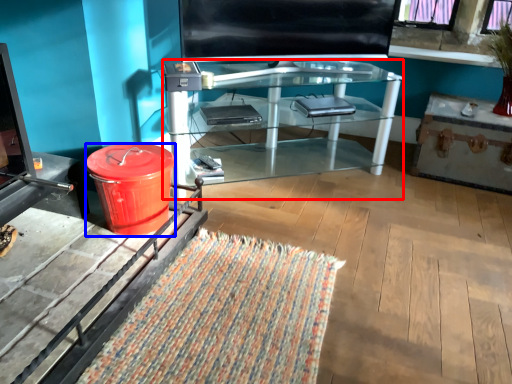
Question: Which object appears closest to the camera in this image, desk (highlighted by a red box) or trash bin/can (highlighted by a blue box)?

Choices:
 (A) desk
 (B) trash bin/can

Answer: (B)